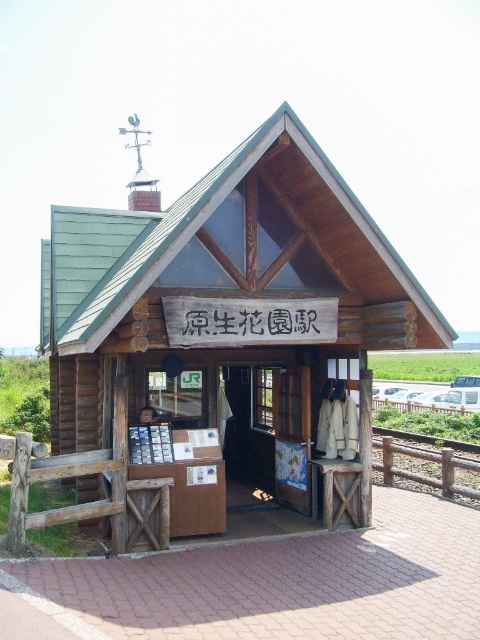
Question: Does wooden cabin at center come behind wooden signboard at center?

Choices:
 (A) yes
 (B) no

Answer: (A)

Question: Is wooden cabin at center wider than wooden signboard at center?

Choices:
 (A) no
 (B) yes

Answer: (A)

Question: Estimate the real-world distances between objects in this image. Which object is closer to the wooden sign at center?

Choices:
 (A) wooden signboard at center
 (B) wooden cabin at center

Answer: (B)

Question: Which point is closer to the camera taking this photo?

Choices:
 (A) (100, 276)
 (B) (215, 488)

Answer: (B)

Question: Does wooden sign at center appear over wooden signboard at center?

Choices:
 (A) no
 (B) yes

Answer: (B)

Question: Which point is closer to the camera?

Choices:
 (A) wooden sign at center
 (B) wooden signboard at center
 (C) wooden cabin at center

Answer: (A)